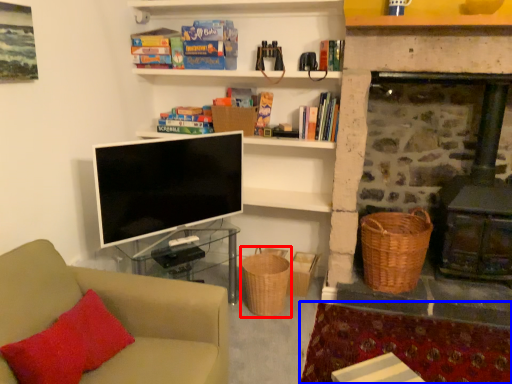
Question: Which of the following is the farthest to the observer, basket (highlighted by a red box) or plain (highlighted by a blue box)?

Choices:
 (A) basket
 (B) plain

Answer: (A)